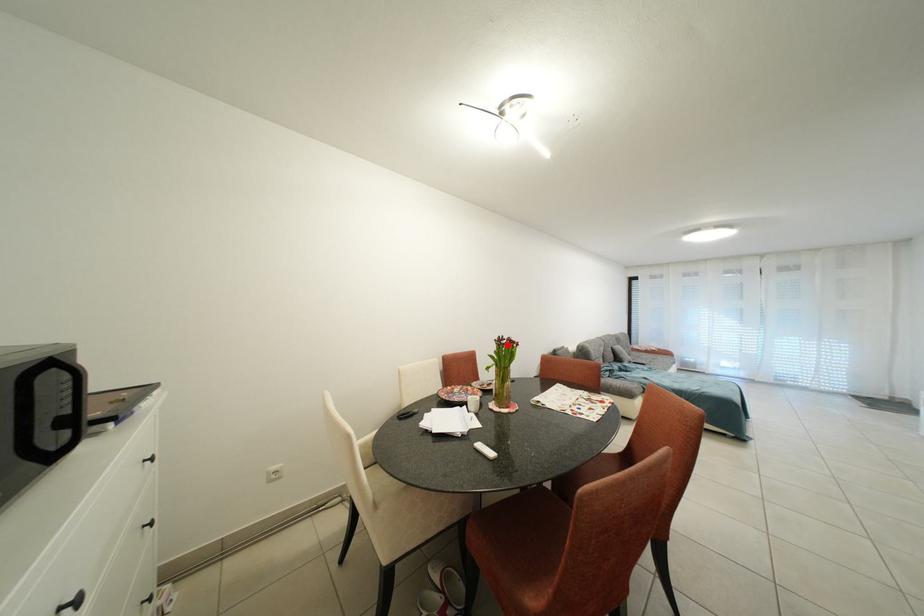
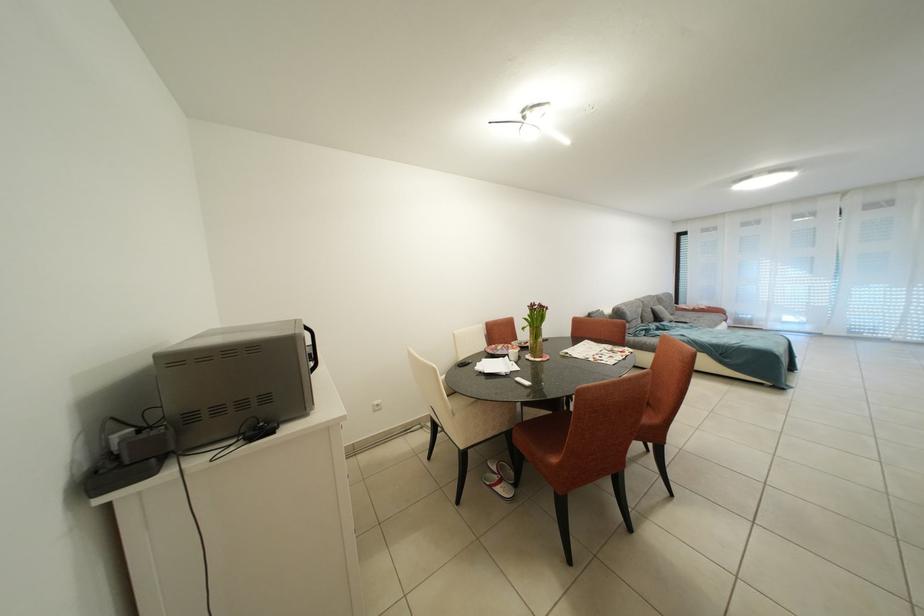
Find the pixel in the second image that matches the highlighted location in the first image.

(540, 310)